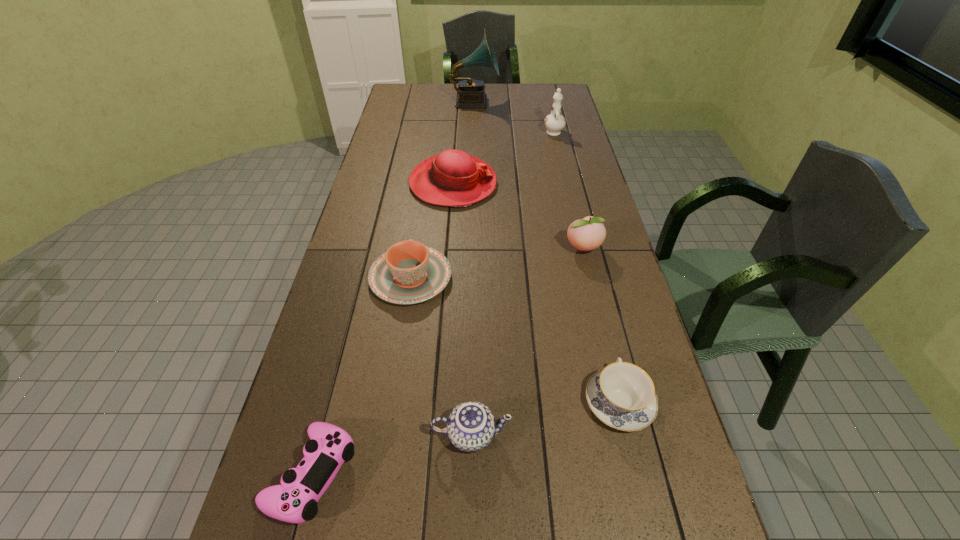
Identify the location of vacant space situated 0.370m with the handle on the side of the shortest chinaware. (587, 264).

The height and width of the screenshot is (540, 960). What are the coordinates of `blank space located 0.250m with the handle on the side of the shortest chinaware` in the screenshot? It's located at (593, 294).

The height and width of the screenshot is (540, 960). In order to click on object present at the far edge in this screenshot , I will do click(470, 93).

Locate an element on the screen. The width and height of the screenshot is (960, 540). chinaware that is positioned at the left edge is located at coordinates (409, 272).

You are a GUI agent. You are given a task and a screenshot of the screen. Output one action in this format:
    pyautogui.click(x=<x>, y=<y>)
    Task: Click on the control present at the left edge
    The image size is (960, 540).
    Given the screenshot: What is the action you would take?
    pyautogui.click(x=295, y=501)

Identify the location of peach that is at the right edge. This screenshot has width=960, height=540. (586, 234).

Identify the location of vacant position at the far edge of the desktop. (488, 96).

Identify the location of vacant space at the left edge of the desktop. (384, 197).

The image size is (960, 540). I want to click on vacant region at the right edge of the desktop, so click(x=549, y=168).

You are a GUI agent. You are given a task and a screenshot of the screen. Output one action in this format:
    pyautogui.click(x=<x>, y=<y>)
    Task: Click on the free space between the shortest chinaware and the hat
    The width and height of the screenshot is (960, 540).
    Given the screenshot: What is the action you would take?
    pyautogui.click(x=536, y=293)